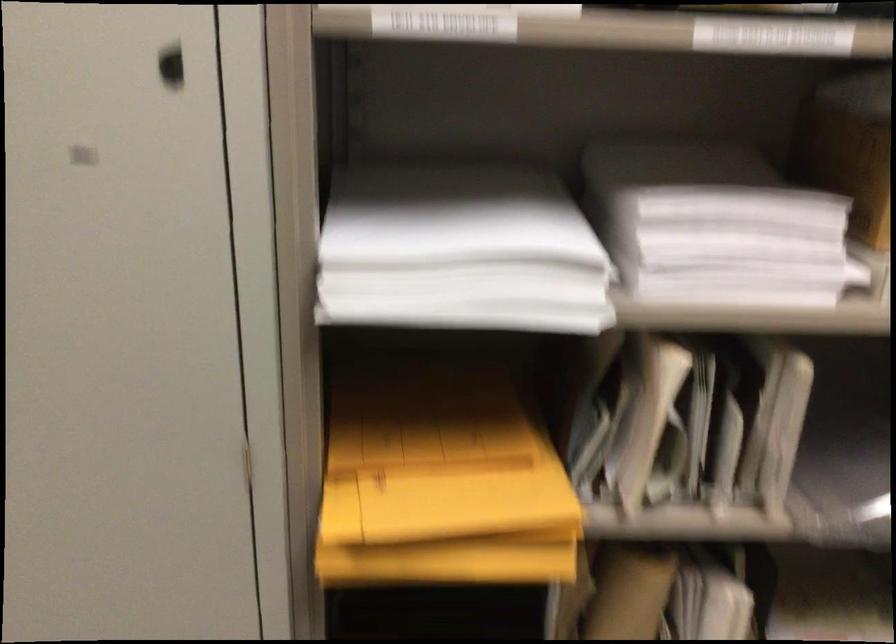
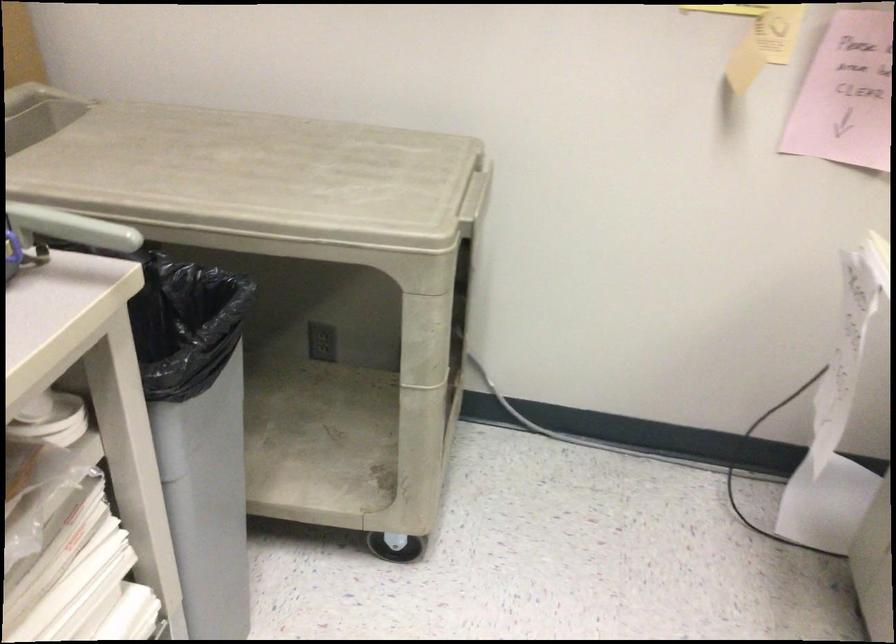
Question: The images are taken continuously from a first-person perspective. In which direction are you moving?

Choices:
 (A) Left
 (B) Right
 (C) Forward
 (D) Backward

Answer: (D)